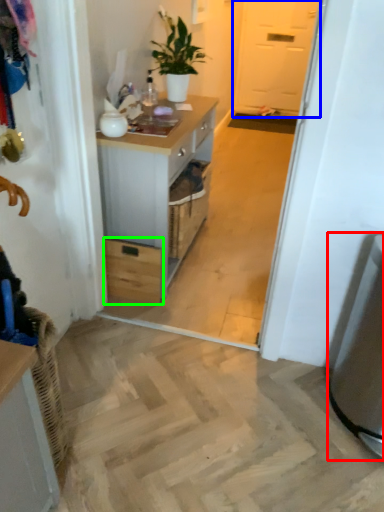
Question: Based on their relative distances, which object is farther from appliance (highlighted by a red box)? Choose from screen door (highlighted by a blue box) and drawer (highlighted by a green box).

Choices:
 (A) screen door
 (B) drawer

Answer: (A)